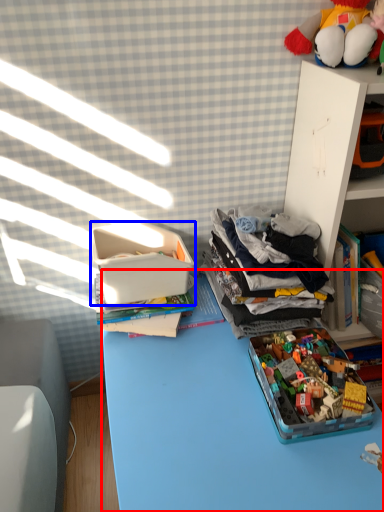
Question: Which object is further to the camera taking this photo, desk (highlighted by a red box) or storage box (highlighted by a blue box)?

Choices:
 (A) desk
 (B) storage box

Answer: (B)